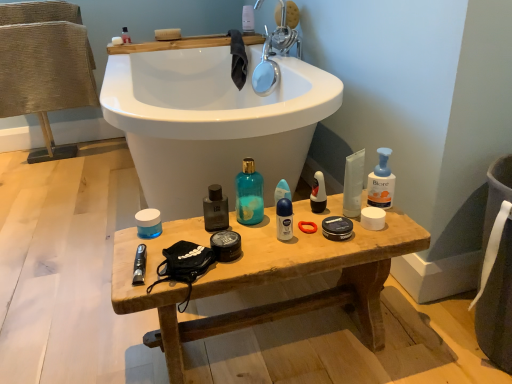
The height and width of the screenshot is (384, 512). I want to click on spots to the right of translucent plastic jar at center, placed as the sixth toiletry when sorted from right to left, so click(x=206, y=232).